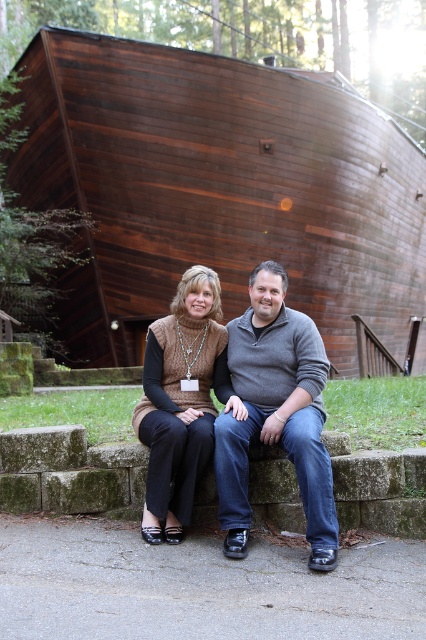
You are standing in front of the wooden building and want to reach the dark wood boat at center and the knit sweater at center. Which object should you move towards first based on their positions?

You should move towards the dark wood boat at center first because it is closer to you than the knit sweater at center.

What is the position of the dark wood boat at center relative to the gray sweater at center?

The dark wood boat at center is above the gray sweater at center.